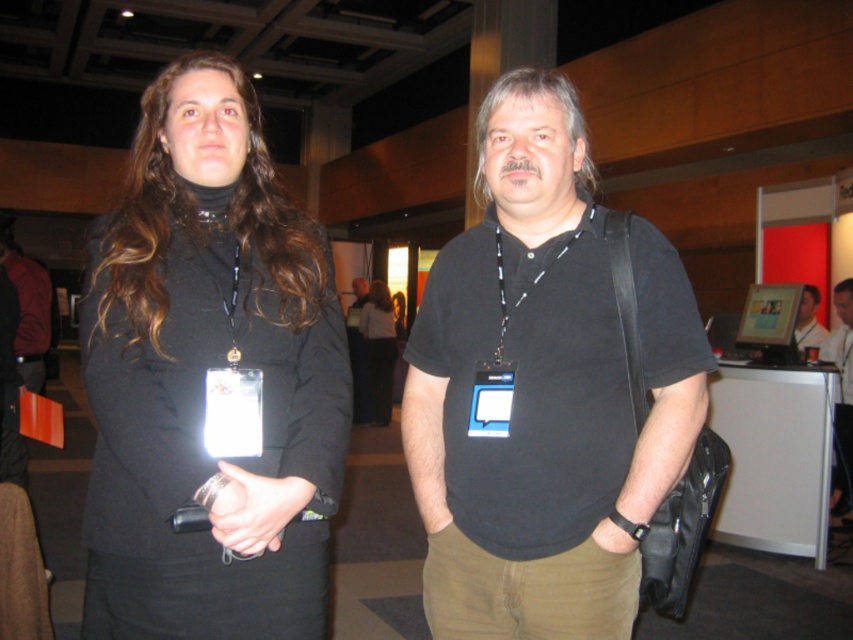
You are organizing a clothing display and need to determine which item takes up more space. Based on the image, which item is larger in size between the black cotton shirt at center and the black fabric jacket at center?

The black fabric jacket at center occupies more space than the black cotton shirt at center according to the description, so the jacket is larger in size.

You are standing in the conference room and want to find the matte black jacket at left. Where should you look?

The matte black jacket at left is located at the 2D coordinates point (x=204, y=376).